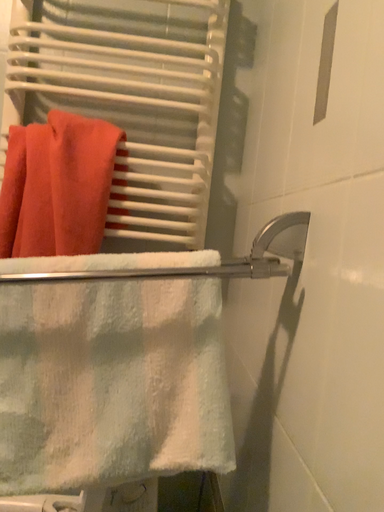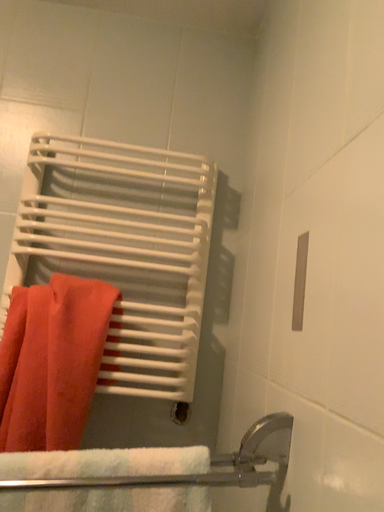
Question: Which way did the camera rotate in the video?

Choices:
 (A) rotated upward
 (B) rotated downward

Answer: (A)